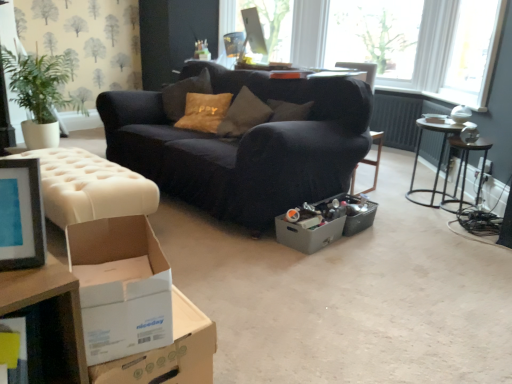
You are a GUI agent. You are given a task and a screenshot of the screen. Output one action in this format:
    pyautogui.click(x=<x>, y=<y>)
    Task: Click on the free spot behind metallic silver table at right, arranged as the 1th table when ordered from the bottom
    
    Given the screenshot: What is the action you would take?
    pyautogui.click(x=406, y=185)